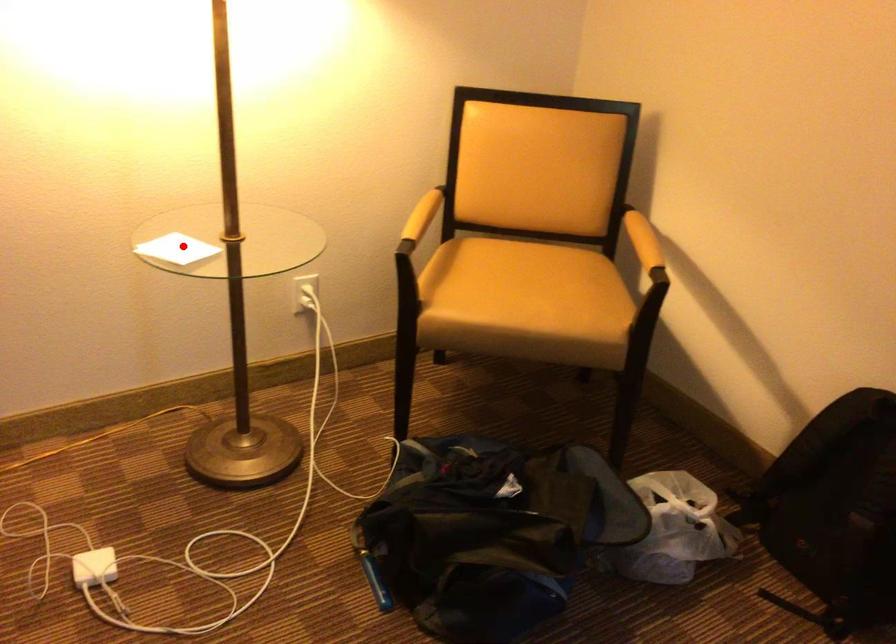
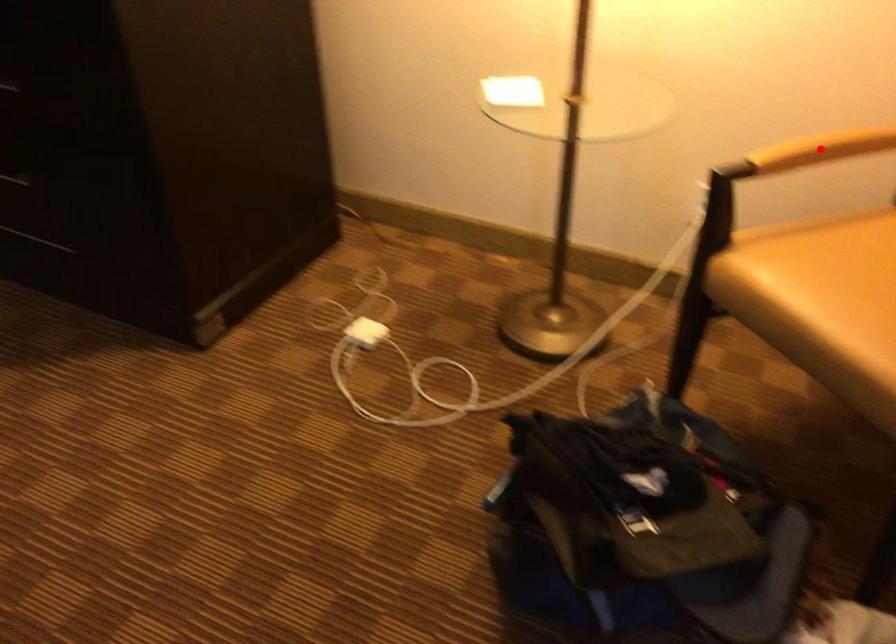
Based on the photo, I am providing you with two images of the same scene from different viewpoints. A red point is marked on the first image and another point is marked on the second image. Is the red point in image1 aligned with the point shown in image2?

No